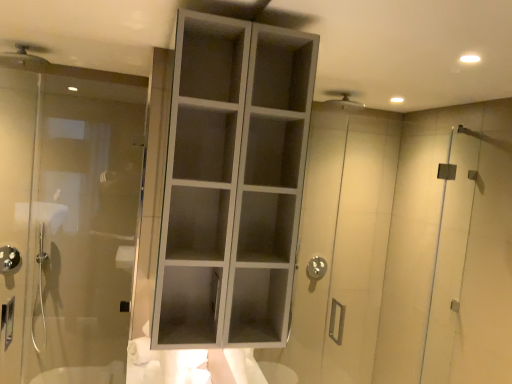
Question: Considering the relative sizes of brushed metal showerhead at lower left, positioned as the 2th shower in right-to-left order, and white matte cabinet at center in the image provided, is brushed metal showerhead at lower left, positioned as the 2th shower in right-to-left order, bigger than white matte cabinet at center?

Choices:
 (A) yes
 (B) no

Answer: (B)

Question: Is brushed metal showerhead at lower left, positioned as the 2th shower in right-to-left order, not near white matte cabinet at center?

Choices:
 (A) no
 (B) yes

Answer: (B)

Question: Could you tell me if brushed metal showerhead at lower left, placed as the 1th shower when sorted from bottom to top, is facing white matte cabinet at center?

Choices:
 (A) no
 (B) yes

Answer: (A)

Question: From a real-world perspective, is brushed metal showerhead at lower left, which is the first shower in left-to-right order, positioned under white matte cabinet at center based on gravity?

Choices:
 (A) no
 (B) yes

Answer: (B)

Question: From the image's perspective, is brushed metal showerhead at lower left, which appears as the 2th shower when viewed from the top, located beneath white matte cabinet at center?

Choices:
 (A) yes
 (B) no

Answer: (A)

Question: In terms of size, does brushed metal showerhead at lower left, the first shower when ordered from back to front, appear bigger or smaller than white matte cabinet at center?

Choices:
 (A) big
 (B) small

Answer: (B)

Question: Do you think brushed metal showerhead at lower left, which is the first shower in left-to-right order, is within white matte cabinet at center, or outside of it?

Choices:
 (A) inside
 (B) outside

Answer: (B)

Question: From a real-world perspective, is brushed metal showerhead at lower left, positioned as the 2th shower in right-to-left order, positioned above or below white matte cabinet at center?

Choices:
 (A) above
 (B) below

Answer: (B)

Question: In the image, is brushed metal showerhead at lower left, which appears as the 2th shower when viewed from the top, positioned in front of or behind white matte cabinet at center?

Choices:
 (A) behind
 (B) front

Answer: (A)

Question: Considering the positions of brushed metal showerhead at lower left, positioned as the 2th shower in right-to-left order, and transparent glass door at left in the image, is brushed metal showerhead at lower left, positioned as the 2th shower in right-to-left order, wider or thinner than transparent glass door at left?

Choices:
 (A) thin
 (B) wide

Answer: (A)

Question: Is point (5, 258) closer or farther from the camera than point (53, 291)?

Choices:
 (A) farther
 (B) closer

Answer: (B)

Question: Is brushed metal showerhead at lower left, positioned as the 2th shower in right-to-left order, situated inside transparent glass door at left or outside?

Choices:
 (A) inside
 (B) outside

Answer: (B)

Question: From a real-world perspective, is brushed metal showerhead at lower left, placed as the 1th shower when sorted from bottom to top, positioned above or below transparent glass door at left?

Choices:
 (A) above
 (B) below

Answer: (B)

Question: Is point (53, 142) closer or farther from the camera than point (37, 48)?

Choices:
 (A) closer
 (B) farther

Answer: (B)

Question: Is transparent glass door at left in front of or behind matte silver shower head at upper left, the 2th shower positioned from the bottom, in the image?

Choices:
 (A) front
 (B) behind

Answer: (A)